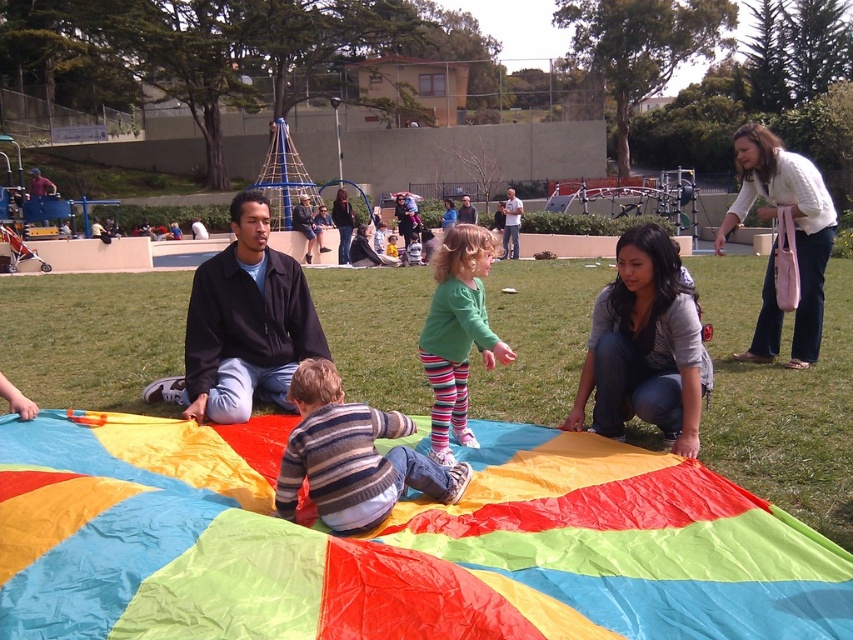
Question: Which is farther from the striped sweater at center?

Choices:
 (A) green fabric parachute at center
 (B) green jersey at center

Answer: (A)

Question: Which is nearer to the white sweater at upper right?

Choices:
 (A) green fabric parachute at center
 (B) green grass at center

Answer: (B)

Question: Is green grass at center below green jersey at center?

Choices:
 (A) yes
 (B) no

Answer: (B)

Question: Which of the following is the farthest from the observer?

Choices:
 (A) (822, 451)
 (B) (186, 372)
 (C) (439, 440)
 (D) (762, 289)

Answer: (D)

Question: Can you confirm if multicolored fabric parachute at center is thinner than white sweater at upper right?

Choices:
 (A) yes
 (B) no

Answer: (A)

Question: Is green grass at center positioned before green fabric parachute at center?

Choices:
 (A) no
 (B) yes

Answer: (B)